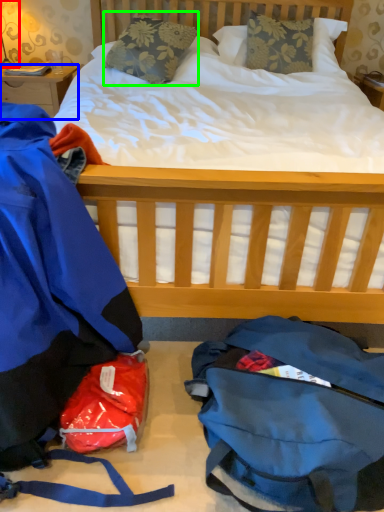
Question: Which object is positioned farthest from lamp (highlighted by a red box)? Select from desk (highlighted by a blue box) and pillow (highlighted by a green box).

Choices:
 (A) desk
 (B) pillow

Answer: (B)